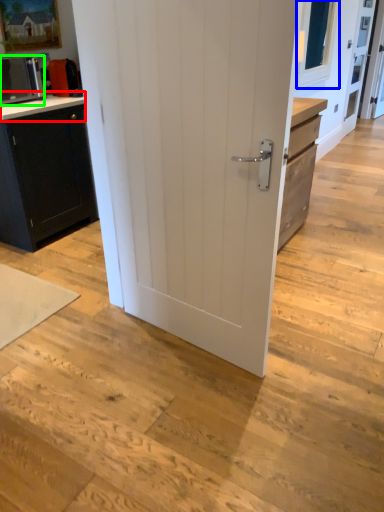
Question: Which is farther away from counter top (highlighted by a red box)? window screen (highlighted by a blue box) or home appliance (highlighted by a green box)?

Choices:
 (A) window screen
 (B) home appliance

Answer: (A)